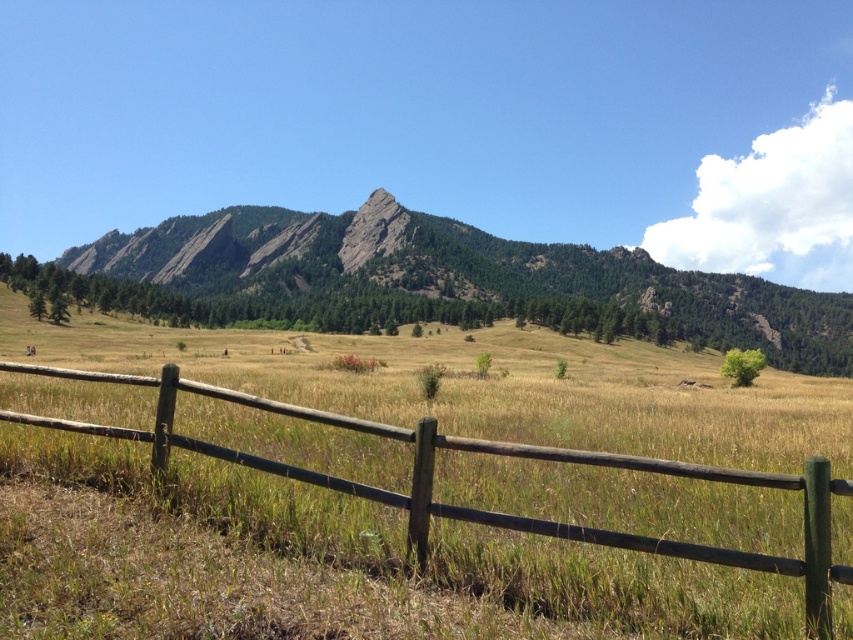
You are standing at the point marked as point (465, 273) in the image. What type of terrain are you currently standing on?

You are standing on green grassy mountain at center.

You are standing in the open field and want to take a photo of both the green grassy mountain at center and the brown wooden fence at lower center. Which object should you zoom in on first to ensure both are in frame?

You should zoom in on the brown wooden fence at lower center first because the green grassy mountain at center is taller, so adjusting the frame to include the taller mountain might require a wider angle, but starting with the closer fence ensures both are visible.

You are standing in the open field and want to walk towards the green grassy mountain at center. Which direction should you head relative to the brown wooden fence at lower center?

The green grassy mountain at center is located above the brown wooden fence at lower center, so you should head towards the direction away from the brown wooden fence at lower center to reach the mountain.